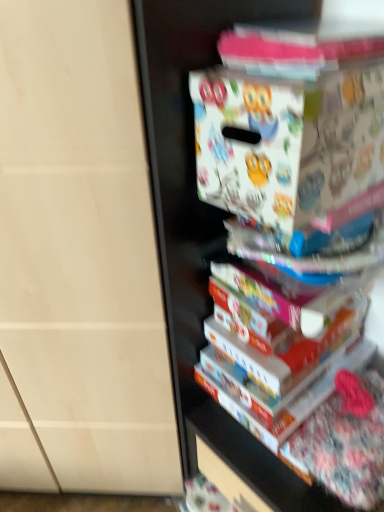
Question: From the image's perspective, does white glossy book at center appear lower than white matte board game box at upper right?

Choices:
 (A) no
 (B) yes

Answer: (B)

Question: Is white glossy book at center closer to the viewer compared to white matte board game box at upper right?

Choices:
 (A) no
 (B) yes

Answer: (A)

Question: Is white glossy book at center not within white matte board game box at upper right?

Choices:
 (A) yes
 (B) no

Answer: (A)

Question: Is white matte board game box at upper right at the back of white glossy book at center?

Choices:
 (A) no
 (B) yes

Answer: (A)

Question: Does white glossy book at center have a smaller size compared to white matte board game box at upper right?

Choices:
 (A) no
 (B) yes

Answer: (B)

Question: Can you confirm if white glossy book at center is shorter than white matte board game box at upper right?

Choices:
 (A) no
 (B) yes

Answer: (B)

Question: Would you say white matte board game box at upper right is outside white glossy book at center?

Choices:
 (A) yes
 (B) no

Answer: (A)

Question: From a real-world perspective, is white matte board game box at upper right physically above white glossy book at center?

Choices:
 (A) no
 (B) yes

Answer: (B)

Question: Is white matte board game box at upper right oriented towards white glossy book at center?

Choices:
 (A) yes
 (B) no

Answer: (B)

Question: From a real-world perspective, does white matte board game box at upper right sit lower than white glossy book at center?

Choices:
 (A) no
 (B) yes

Answer: (A)

Question: Does white matte board game box at upper right have a lesser width compared to white glossy book at center?

Choices:
 (A) no
 (B) yes

Answer: (B)

Question: Could white glossy book at center be considered to be inside white matte board game box at upper right?

Choices:
 (A) yes
 (B) no

Answer: (B)

Question: In terms of size, does white glossy book at center appear bigger or smaller than white matte board game box at upper right?

Choices:
 (A) big
 (B) small

Answer: (B)